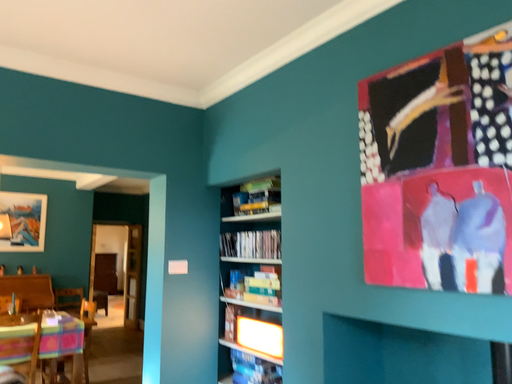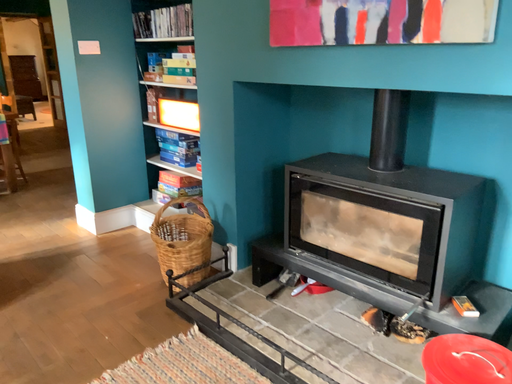
Question: Which way did the camera rotate in the video?

Choices:
 (A) rotated right
 (B) rotated left

Answer: (A)